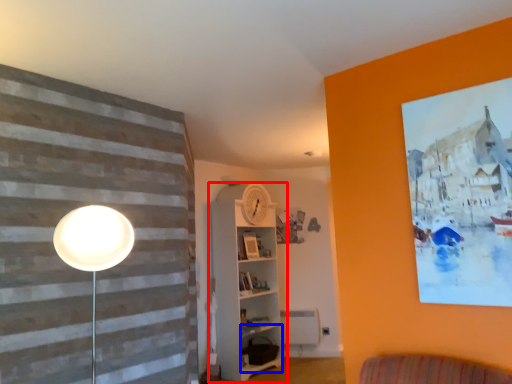
Question: Which object is closer to the camera taking this photo, shelf (highlighted by a red box) or shelf (highlighted by a blue box)?

Choices:
 (A) shelf
 (B) shelf

Answer: (A)